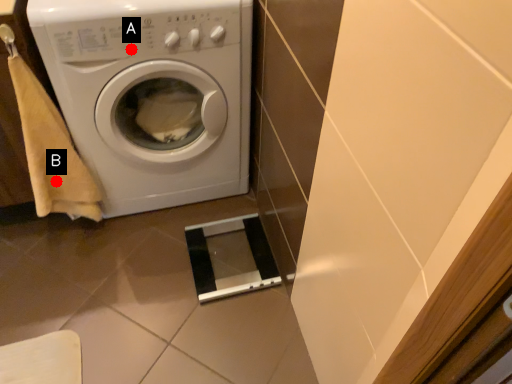
Question: Two points are circled on the image, labeled by A and B beside each circle. Which of the following is the farthest from the observer?

Choices:
 (A) A is further
 (B) B is further

Answer: (B)